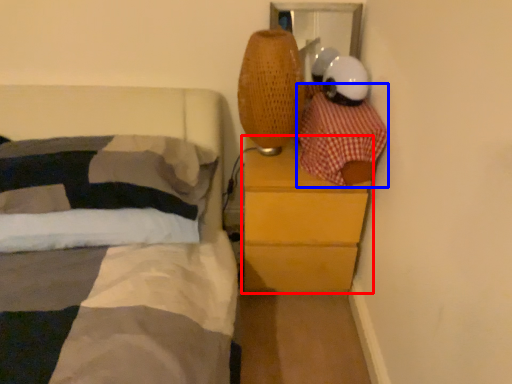
Question: Which point is further to the camera, chest of drawers (highlighted by a red box) or blanket (highlighted by a blue box)?

Choices:
 (A) chest of drawers
 (B) blanket

Answer: (A)